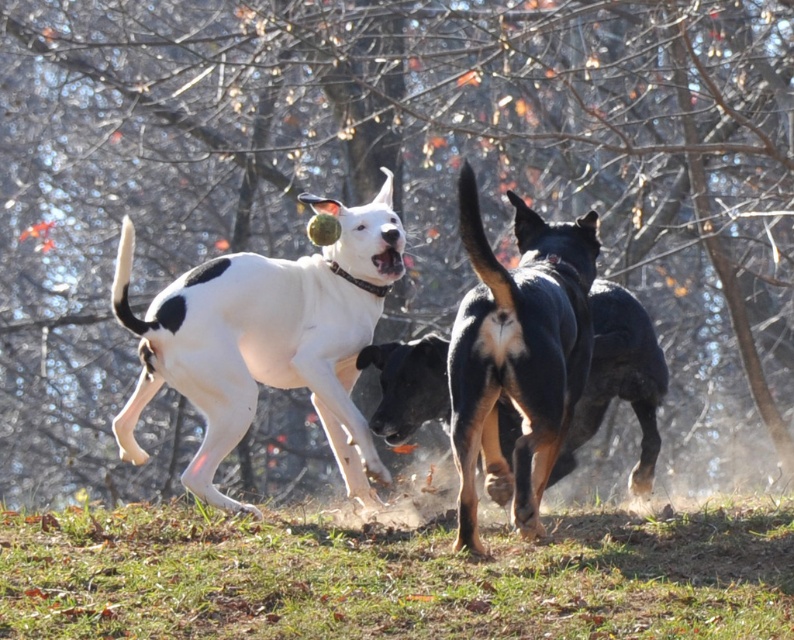
Question: Is green grass at lower center above black glossy dog at center?

Choices:
 (A) yes
 (B) no

Answer: (B)

Question: Based on their relative distances, which object is farther from the black glossy dog at center?

Choices:
 (A) black fur dog at center
 (B) white matte dog at center
 (C) green grass at lower center

Answer: (B)

Question: Which of these objects is positioned farthest from the white matte dog at center?

Choices:
 (A) black fur dog at center
 (B) green grass at lower center
 (C) black glossy dog at center

Answer: (A)

Question: Observing the image, what is the correct spatial positioning of green grass at lower center in reference to white matte dog at center?

Choices:
 (A) right
 (B) left

Answer: (A)

Question: Among these points, which one is nearest to the camera?

Choices:
 (A) (584, 362)
 (B) (633, 321)
 (C) (307, 339)
 (D) (469, 634)

Answer: (D)

Question: Is green grass at lower center positioned at the back of white matte dog at center?

Choices:
 (A) no
 (B) yes

Answer: (A)